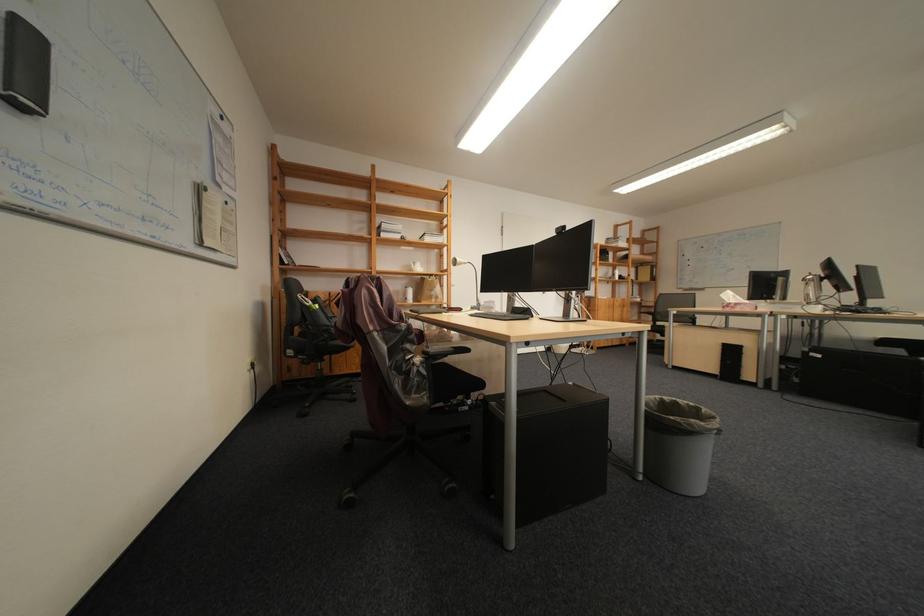
The width and height of the screenshot is (924, 616). What are the coordinates of `white teapot handle` in the screenshot? It's located at (416, 265).